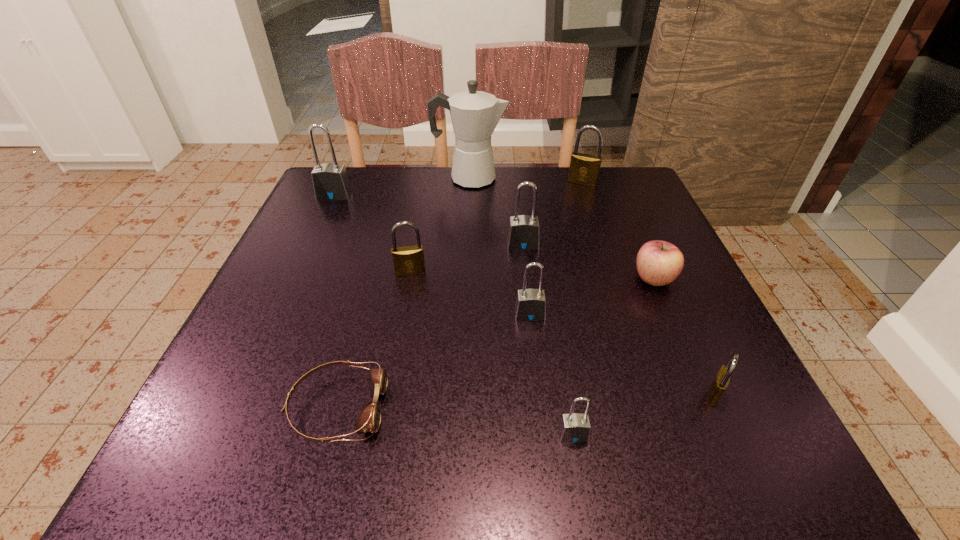
Locate an element on the screen. vacant space located on the front of the second brass padlock from left to right is located at coordinates (616, 284).

Where is `free spot located on the shackle of the second biggest gray padlock`? The image size is (960, 540). free spot located on the shackle of the second biggest gray padlock is located at coordinates (529, 294).

Image resolution: width=960 pixels, height=540 pixels. I want to click on free space located 0.210m on the shackle of the seventh farthest object, so click(543, 434).

This screenshot has width=960, height=540. Find the location of `vacant space located 0.120m on the back of the second farthest brass padlock`. vacant space located 0.120m on the back of the second farthest brass padlock is located at coordinates (418, 232).

Find the location of a particular element. The width and height of the screenshot is (960, 540). free space located 0.220m on the left of the apple is located at coordinates (517, 279).

Locate an element on the screen. The image size is (960, 540). free location located on the shackle of the nearest padlock is located at coordinates (581, 480).

Find the location of a particular element. The height and width of the screenshot is (540, 960). free space located 0.120m on the back of the sixth farthest padlock is located at coordinates (682, 324).

Identify the location of free space located through the lenses of the goggles. The height and width of the screenshot is (540, 960). (425, 407).

Where is `coffeepot located in the far edge section of the desktop`? This screenshot has width=960, height=540. coffeepot located in the far edge section of the desktop is located at coordinates (475, 114).

Locate an element on the screen. padlock that is at the near edge is located at coordinates (574, 427).